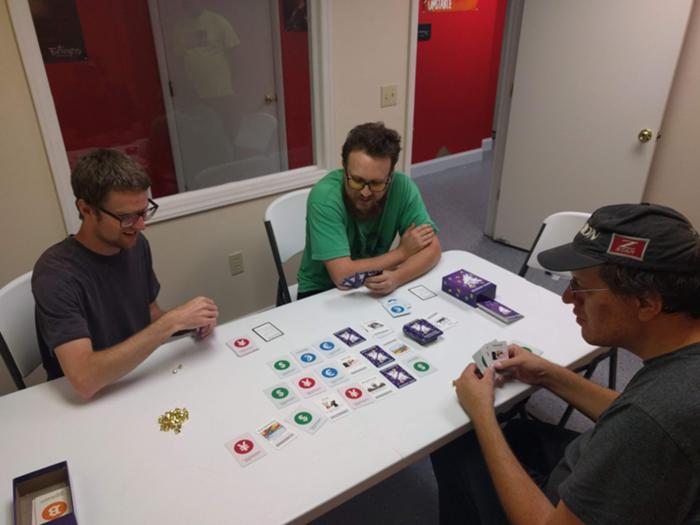
The image size is (700, 525). Identify the location of red wall. (452, 65), (117, 75).